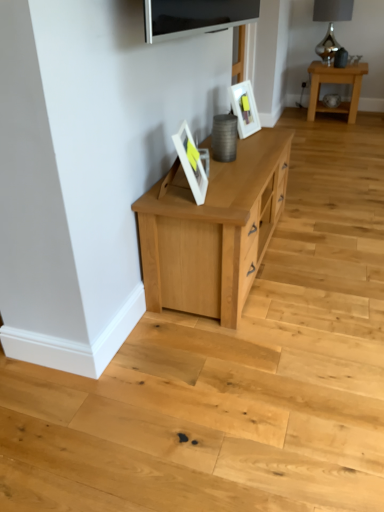
Question: Does matte white picture frame at center, the 1th picture frame viewed from the left, have a smaller size compared to satin silver lamp at upper right?

Choices:
 (A) no
 (B) yes

Answer: (B)

Question: Does matte white picture frame at center, acting as the 2th picture frame starting from the top, have a lesser height compared to satin silver lamp at upper right?

Choices:
 (A) yes
 (B) no

Answer: (A)

Question: From the image's perspective, is matte white picture frame at center, the first picture frame positioned from the bottom, located beneath satin silver lamp at upper right?

Choices:
 (A) no
 (B) yes

Answer: (B)

Question: Is matte white picture frame at center, the 1th picture frame viewed from the left, oriented away from satin silver lamp at upper right?

Choices:
 (A) no
 (B) yes

Answer: (A)

Question: Does matte white picture frame at center, which is counted as the first picture frame, starting from the front, have a lesser width compared to satin silver lamp at upper right?

Choices:
 (A) yes
 (B) no

Answer: (A)

Question: Choose the correct answer: Is satin silver lamp at upper right inside white glossy picture frame at upper center, the first picture frame when ordered from right to left, or outside it?

Choices:
 (A) inside
 (B) outside

Answer: (B)

Question: Based on their sizes in the image, would you say satin silver lamp at upper right is bigger or smaller than white glossy picture frame at upper center, which appears as the 2th picture frame when viewed from the front?

Choices:
 (A) big
 (B) small

Answer: (A)

Question: From the image's perspective, is satin silver lamp at upper right positioned above or below white glossy picture frame at upper center, the second picture frame in the left-to-right sequence?

Choices:
 (A) below
 (B) above

Answer: (B)

Question: Does point (327, 18) appear closer or farther from the camera than point (253, 108)?

Choices:
 (A) closer
 (B) farther

Answer: (B)

Question: Looking at the image, does white glossy picture frame at upper center, the 2th picture frame positioned from the bottom, seem bigger or smaller compared to flat-screen tv at upper center?

Choices:
 (A) big
 (B) small

Answer: (B)

Question: From a real-world perspective, is white glossy picture frame at upper center, the first picture frame when ordered from right to left, physically located above or below flat-screen tv at upper center?

Choices:
 (A) below
 (B) above

Answer: (A)

Question: Is white glossy picture frame at upper center, which appears as the 2th picture frame when viewed from the front, taller or shorter than flat-screen tv at upper center?

Choices:
 (A) short
 (B) tall

Answer: (B)

Question: Does point click(241, 87) appear closer or farther from the camera than point click(155, 32)?

Choices:
 (A) farther
 (B) closer

Answer: (A)

Question: Looking at the image, does white glossy picture frame at upper center, the first picture frame when ordered from right to left, seem bigger or smaller compared to matte white picture frame at center, the first picture frame positioned from the bottom?

Choices:
 (A) small
 (B) big

Answer: (B)

Question: Is white glossy picture frame at upper center, which appears as the 2th picture frame when viewed from the front, inside or outside of matte white picture frame at center, which is the second picture frame from back to front?

Choices:
 (A) outside
 (B) inside

Answer: (A)